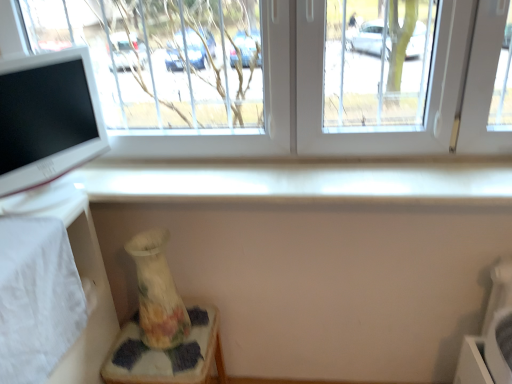
The image size is (512, 384). I want to click on free location in front of floral-patterned ceramic vase at lower left, so click(160, 363).